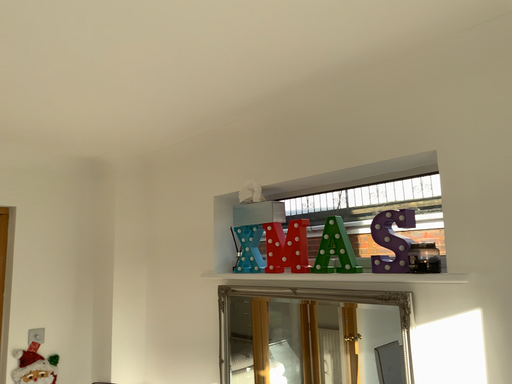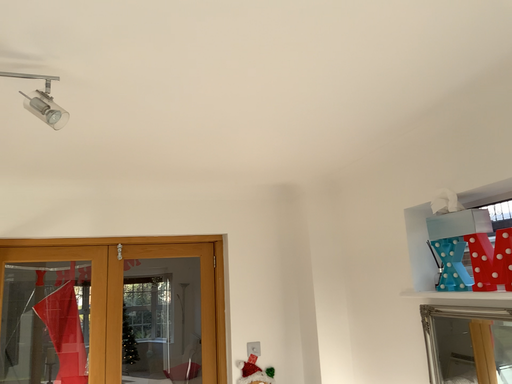
Question: Which way did the camera rotate in the video?

Choices:
 (A) rotated right
 (B) rotated left

Answer: (B)